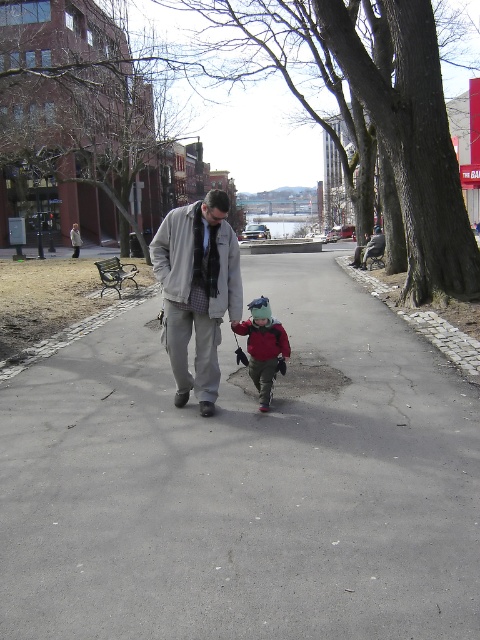
You are standing at the point labeled point (168,419) and want to walk towards the point labeled point (286,346). Given that you can only move along the paved pathway, which direction should you face to reach your destination?

Since point (168,419) is closer to the camera than point (286,346), you should face away from the camera to move towards the farther point. This means turning your back to the camera and walking along the pathway in that direction.

You are a photographer trying to capture a photo of both the gray woolen jacket at center and the matte red jacket at center in the same frame. Given that your camera has a fixed focus range, which jacket should you position closer to ensure both are in focus?

The gray woolen jacket at center is wider than the matte red jacket at center, so positioning the gray woolen jacket at center closer to the camera will help both jackets fit within the focus range.

You are a delivery robot with a width of 1.5 meters. You need to navigate through the gray asphalt pavement at center while avoiding the matte red jacket at center. Can you safely pass through the space between them?

The gray asphalt pavement at center and matte red jacket at center are 1.71 meters apart from each other. Since the robot is 1.5 meters wide, there is enough space to pass safely between them.